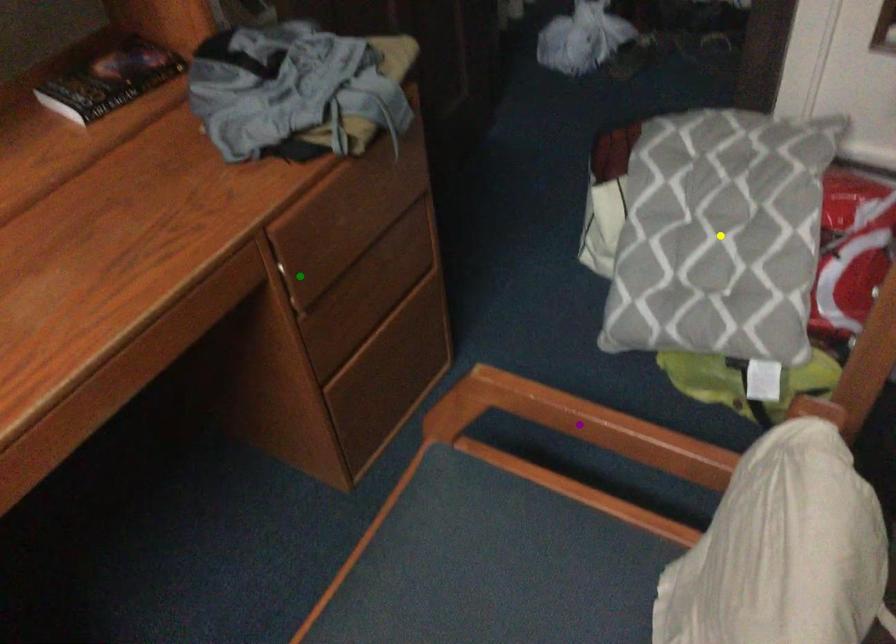
Based on the photo, order these from nearest to farthest:
purple point
yellow point
green point

purple point, green point, yellow point